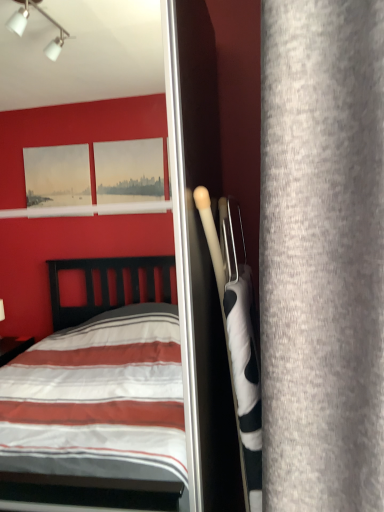
Locate an element on the screen. Image resolution: width=384 pixels, height=512 pixels. white glossy screen door at center is located at coordinates (77, 216).

Measure the distance between white glossy screen door at center and camera.

A distance of 10.37 feet exists between white glossy screen door at center and camera.

What do you see at coordinates (77, 216) in the screenshot? This screenshot has height=512, width=384. I see `white glossy screen door at center` at bounding box center [77, 216].

Identify the location of gray fabric curtain at right. Image resolution: width=384 pixels, height=512 pixels. (322, 255).

Describe the element at coordinates (322, 255) in the screenshot. This screenshot has width=384, height=512. I see `gray fabric curtain at right` at that location.

This screenshot has width=384, height=512. I want to click on white glossy screen door at center, so click(77, 216).

Would you say white glossy screen door at center is to the left or to the right of gray fabric curtain at right in the picture?

From the image, it's evident that white glossy screen door at center is to the left of gray fabric curtain at right.

Which object is more forward, white glossy screen door at center or gray fabric curtain at right?

gray fabric curtain at right is more forward.

Is point (15, 112) positioned in front of point (356, 318)?

No, it is behind (356, 318).

In the scene shown: From the image's perspective, between white glossy screen door at center and gray fabric curtain at right, which one is located above?

gray fabric curtain at right.

Consider the image. From a real-world perspective, is white glossy screen door at center physically located above or below gray fabric curtain at right?

From a real-world perspective, white glossy screen door at center is physically below gray fabric curtain at right.

Looking at their sizes, would you say white glossy screen door at center is wider or thinner than gray fabric curtain at right?

Clearly, white glossy screen door at center has more width compared to gray fabric curtain at right.

Between white glossy screen door at center and gray fabric curtain at right, which one has less height?

Standing shorter between the two is gray fabric curtain at right.

Looking at this image, is white glossy screen door at center bigger than gray fabric curtain at right?

Correct, white glossy screen door at center is larger in size than gray fabric curtain at right.

Is white glossy screen door at center surrounding gray fabric curtain at right?

That's incorrect, gray fabric curtain at right is not inside white glossy screen door at center.

Is white glossy screen door at center far away from gray fabric curtain at right?

white glossy screen door at center is positioned a significant distance from gray fabric curtain at right.

Is white glossy screen door at center aimed at gray fabric curtain at right?

No, white glossy screen door at center is not oriented towards gray fabric curtain at right.

What's the angular difference between white glossy screen door at center and gray fabric curtain at right's facing directions?

The facing directions of white glossy screen door at center and gray fabric curtain at right are 88.7 degrees apart.

How much distance is there between white glossy screen door at center and gray fabric curtain at right?

The distance of white glossy screen door at center from gray fabric curtain at right is 9.35 feet.

At what (x,y) coordinates should I click in order to perform the action: click on screen door that appears below the gray fabric curtain at right (from the image's perspective). Please return your answer as a coordinate pair (x, y). Image resolution: width=384 pixels, height=512 pixels. Looking at the image, I should click on (77, 216).

Is gray fabric curtain at right to the left or to the right of white glossy screen door at center in the image?

gray fabric curtain at right is to the right of white glossy screen door at center.

Is gray fabric curtain at right in front of or behind white glossy screen door at center in the image?

Clearly, gray fabric curtain at right is in front of white glossy screen door at center.

Is point (358, 367) closer to viewer compared to point (44, 331)?

Yes, point (358, 367) is closer to viewer.

From the image's perspective, does gray fabric curtain at right appear lower than white glossy screen door at center?

Incorrect, from the image's perspective, gray fabric curtain at right is higher than white glossy screen door at center.

From a real-world perspective, which object stands above the other?

In real-world perspective, gray fabric curtain at right is above.

Looking at this image, between gray fabric curtain at right and white glossy screen door at center, which one has larger width?

white glossy screen door at center is wider.

Considering the relative sizes of gray fabric curtain at right and white glossy screen door at center in the image provided, is gray fabric curtain at right taller than white glossy screen door at center?

No.

Between gray fabric curtain at right and white glossy screen door at center, which one has larger size?

white glossy screen door at center is bigger.

Would you say gray fabric curtain at right contains white glossy screen door at center?

No, white glossy screen door at center is not a part of gray fabric curtain at right.

Is the surface of gray fabric curtain at right in direct contact with white glossy screen door at center?

No, gray fabric curtain at right is not touching white glossy screen door at center.

Is gray fabric curtain at right positioned with its back to white glossy screen door at center?

gray fabric curtain at right does not have its back to white glossy screen door at center.

There is a white glossy screen door at center. At what (x,y) coordinates should I click in order to perform the action: click on curtain above it (from a real-world perspective). Please return your answer as a coordinate pair (x, y). This screenshot has width=384, height=512. Looking at the image, I should click on (322, 255).

Where is `screen door located on the left of gray fabric curtain at right`? The width and height of the screenshot is (384, 512). screen door located on the left of gray fabric curtain at right is located at coordinates (77, 216).

The width and height of the screenshot is (384, 512). Identify the location of screen door located behind the gray fabric curtain at right. (77, 216).